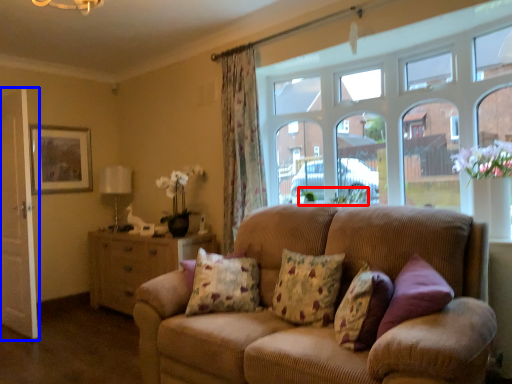
Question: Among these objects, which one is nearest to the camera, plant (highlighted by a red box) or screen door (highlighted by a blue box)?

Choices:
 (A) plant
 (B) screen door

Answer: (A)